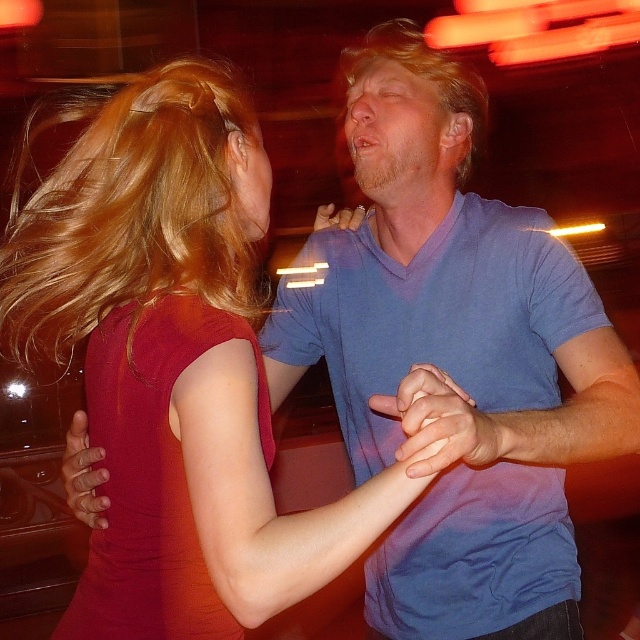
Question: Based on their relative distances, which object is nearer to the matte skin hand at center?

Choices:
 (A) matte red dress at center
 (B) blondehair at center
 (C) blondehair at upper left
 (D) matte blue shirt at center

Answer: (A)

Question: Can you confirm if matte red dress at center is bigger than matte skin hand at center?

Choices:
 (A) no
 (B) yes

Answer: (B)

Question: Can you confirm if blondehair at upper left is smaller than smooth skin hand at center?

Choices:
 (A) yes
 (B) no

Answer: (B)

Question: Which of these objects is positioned farthest from the blondehair at center?

Choices:
 (A) matte red dress at center
 (B) matte skin hand at center
 (C) blondehair at upper left
 (D) smooth skin hand at center

Answer: (B)

Question: Is smooth skin hand at center in front of matte skin hand at center?

Choices:
 (A) no
 (B) yes

Answer: (B)

Question: Estimate the real-world distances between objects in this image. Which object is closer to the matte skin hand at center?

Choices:
 (A) blondehair at upper left
 (B) blondehair at center

Answer: (A)